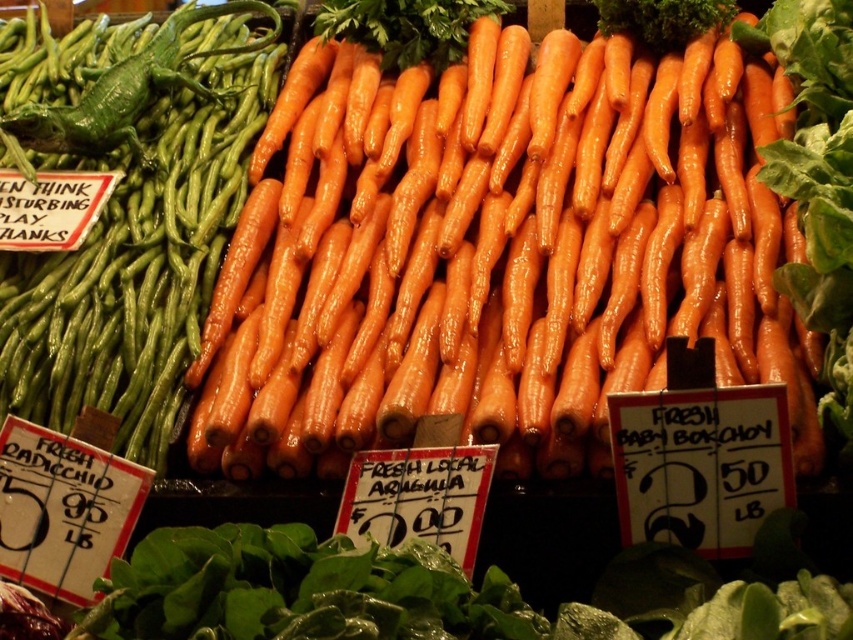
You are a customer at the market stall looking at the carrots and green beans. There are two points marked in the scene. One is at coordinate point (358, 163) and the other is at coordinate point (207, 253). Which point is closer to you?

Point (207, 253) is closer to you because it is less further to the camera than point (358, 163).

You are a customer at the market stall and want to grab both the orange smooth carrots at center and the green matte string beans at upper left. If your basket can only hold items within a 30 inch radius, will you be able to collect both without moving the basket?

The distance between the orange smooth carrots at center and the green matte string beans at upper left is 32.66 inches, which exceeds the 30 inch radius of the basket. Therefore, you cannot collect both items without moving the basket.

What vegetable is located at the coordinates point (497, 252) in the market stall scene?

The orange smooth carrots at center are located at point (497, 252).